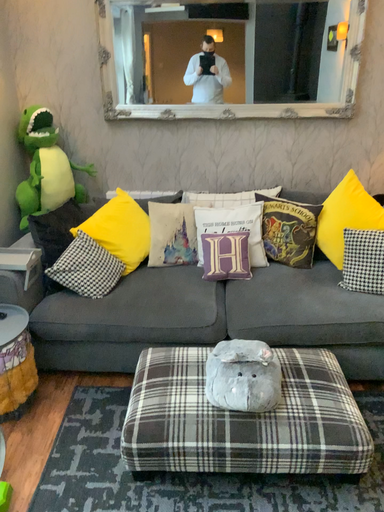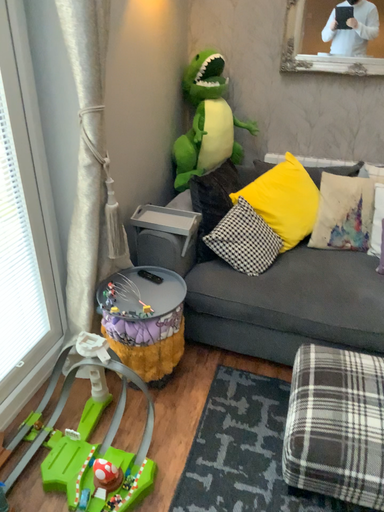
Question: Which way did the camera rotate in the video?

Choices:
 (A) rotated left
 (B) rotated right

Answer: (A)